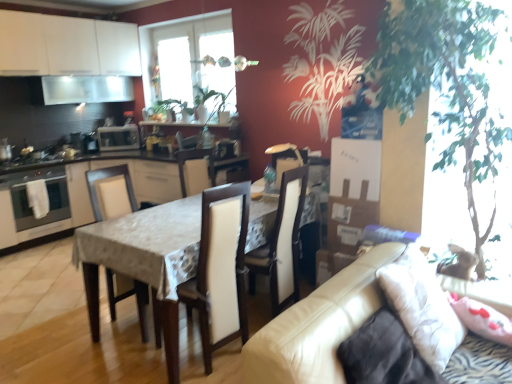
The image size is (512, 384). I want to click on free space in front of white fabric chair at center, arranged as the 1th chair when viewed from the left, so click(112, 356).